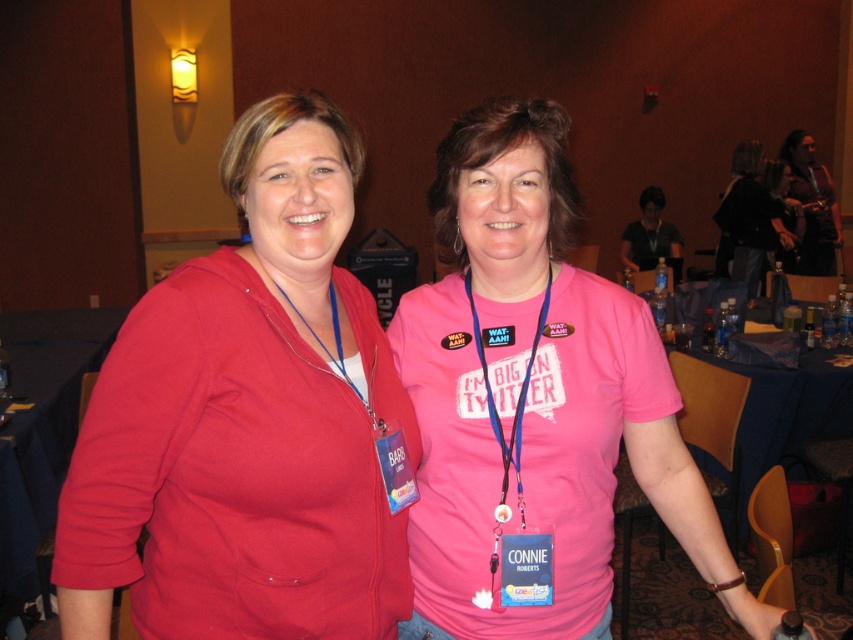
You are at a conference and need to locate the registration desk. You see a blue fabric lanyard at center and a matte black jacket at upper right. Which object is positioned lower in the image?

The blue fabric lanyard at center is below matte black jacket at upper right, so the blue fabric lanyard at center is positioned lower in the image.

You are organizing a photo shoot and need to ensure that all accessories are visible in the frame. Given the blue fabric lanyard at center and the matte black shirt at center, which item might require adjustment to ensure it is more prominently featured?

The blue fabric lanyard at center has a smaller size compared to matte black shirt at center, so the lanyard might need to be moved closer to the camera or positioned higher to ensure it is more prominently featured.